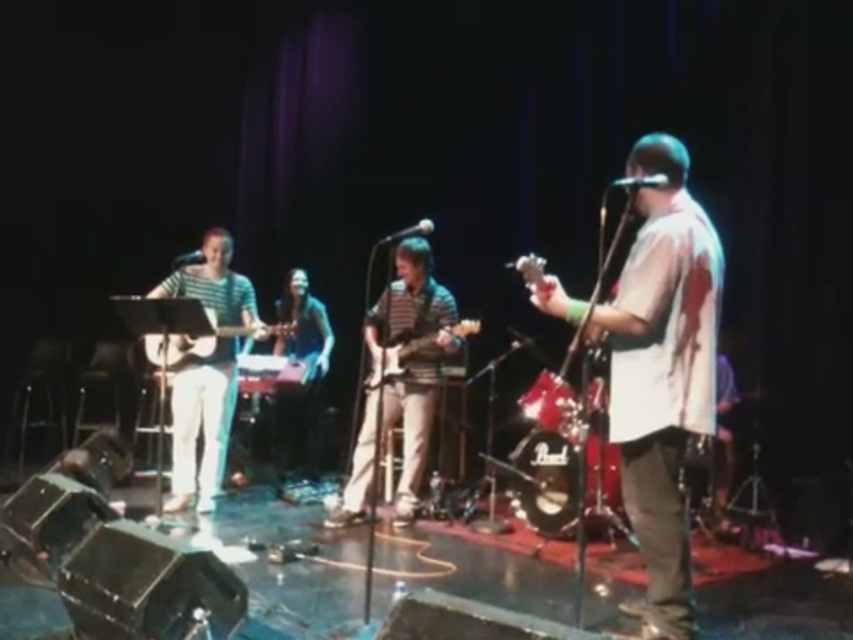
What are the coordinates of `striped fabric guitar at center` in the screenshot? It's located at (200, 417).

Which is behind, point (213, 356) or point (314, 392)?

The point (314, 392) is more distant.

You are a GUI agent. You are given a task and a screenshot of the screen. Output one action in this format:
    pyautogui.click(x=<x>, y=<y>)
    Task: Click on the striped fabric guitar at center
    The height and width of the screenshot is (640, 853).
    Given the screenshot: What is the action you would take?
    pyautogui.click(x=200, y=417)

Between point (517, 260) and point (361, 442), which one is positioned in front?

Point (361, 442)

In the scene shown: Between white cotton shirt at right and striped shirt at center, which one has more height?

white cotton shirt at right

Which is in front, point (660, 216) or point (366, 424)?

Positioned in front is point (660, 216).

Image resolution: width=853 pixels, height=640 pixels. I want to click on white cotton shirt at right, so click(660, 371).

Between shiny black guitar at center and matte wood acoustic guitar at center, which one is positioned lower?

shiny black guitar at center is below.

Is point (289, 317) closer to camera compared to point (259, 337)?

No, (289, 317) is further to viewer.

Where is `shiny black guitar at center`? shiny black guitar at center is located at coordinates (305, 360).